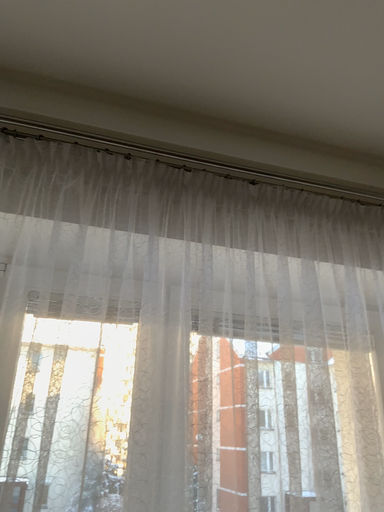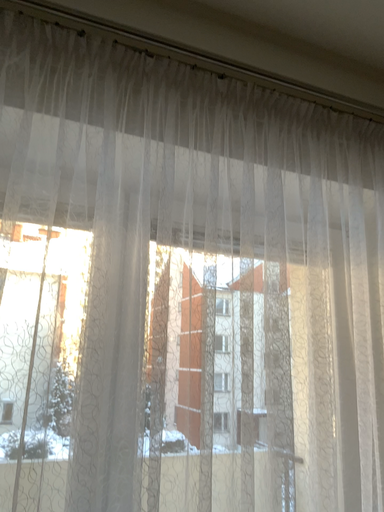
Question: Which way did the camera rotate in the video?

Choices:
 (A) rotated downward
 (B) rotated upward

Answer: (A)